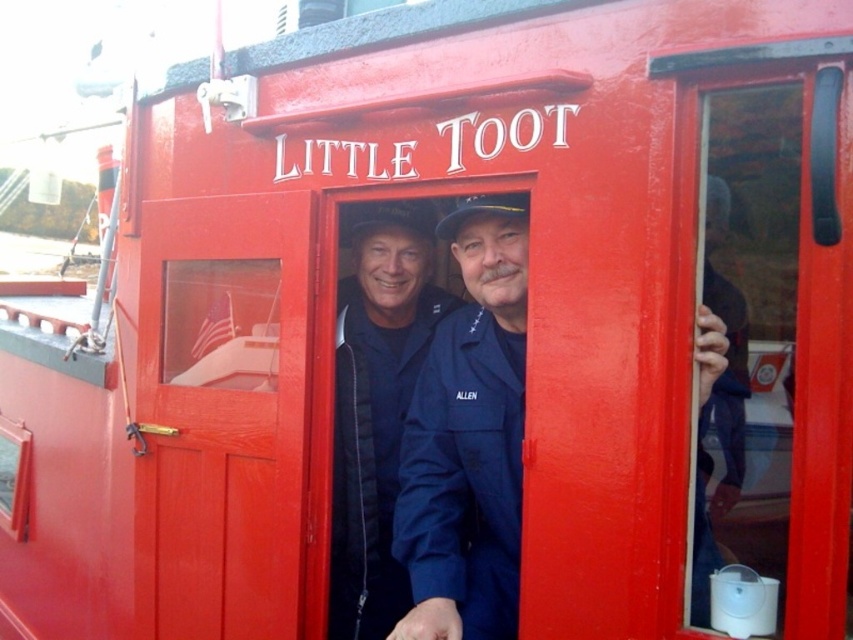
Question: Which point is farther from the camera taking this photo?

Choices:
 (A) (407, 595)
 (B) (451, 326)

Answer: (A)

Question: Which point appears farthest from the camera in this image?

Choices:
 (A) (399, 317)
 (B) (726, 509)

Answer: (A)

Question: Is blue fabric jacket at center above blue denim jacket at right?

Choices:
 (A) yes
 (B) no

Answer: (B)

Question: Does blue fabric jacket at center appear on the right side of blue denim jacket at right?

Choices:
 (A) no
 (B) yes

Answer: (A)

Question: Which point is farther to the camera?

Choices:
 (A) (395, 358)
 (B) (730, 440)
 (C) (473, 394)

Answer: (A)

Question: Is blue fabric uniform at center wider than blue denim jacket at right?

Choices:
 (A) yes
 (B) no

Answer: (A)